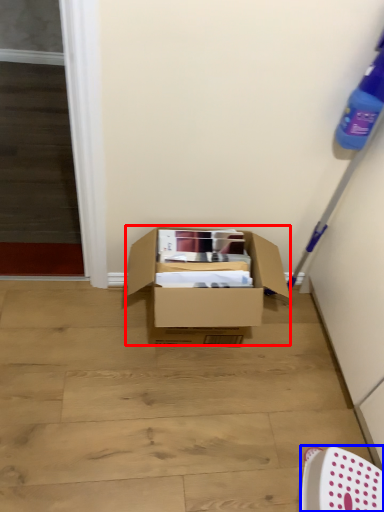
Question: Which object appears closest to the camera in this image, box (highlighted by a red box) or chair (highlighted by a blue box)?

Choices:
 (A) box
 (B) chair

Answer: (B)